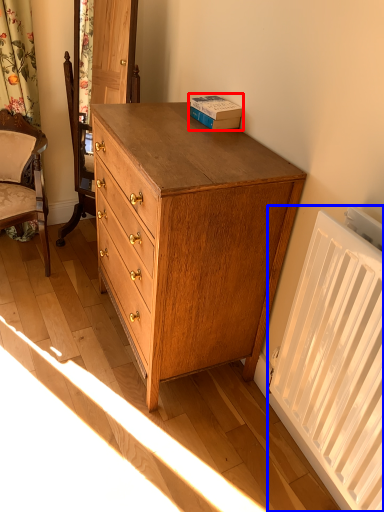
Question: Among these objects, which one is farthest to the camera, book (highlighted by a red box) or radiator (highlighted by a blue box)?

Choices:
 (A) book
 (B) radiator

Answer: (A)